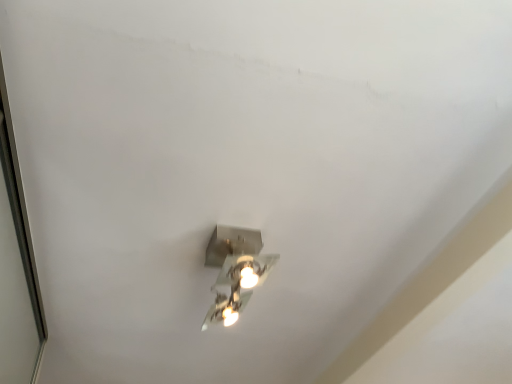
Question: From a real-world perspective, is transparent glass door at left on metallic silver light fixture at center?

Choices:
 (A) no
 (B) yes

Answer: (A)

Question: From the image's perspective, is transparent glass door at left below metallic silver light fixture at center?

Choices:
 (A) yes
 (B) no

Answer: (A)

Question: From the image's perspective, does transparent glass door at left appear higher than metallic silver light fixture at center?

Choices:
 (A) no
 (B) yes

Answer: (A)

Question: Does transparent glass door at left have a greater width compared to metallic silver light fixture at center?

Choices:
 (A) no
 (B) yes

Answer: (A)

Question: Can metallic silver light fixture at center be found inside transparent glass door at left?

Choices:
 (A) no
 (B) yes

Answer: (A)

Question: Is transparent glass door at left smaller than metallic silver light fixture at center?

Choices:
 (A) yes
 (B) no

Answer: (B)

Question: Is transparent glass door at left surrounded by metallic silver light fixture at center?

Choices:
 (A) no
 (B) yes

Answer: (A)

Question: Can you confirm if metallic silver light fixture at center is bigger than transparent glass door at left?

Choices:
 (A) yes
 (B) no

Answer: (B)

Question: From the image's perspective, is metallic silver light fixture at center under transparent glass door at left?

Choices:
 (A) yes
 (B) no

Answer: (B)

Question: Does metallic silver light fixture at center come in front of transparent glass door at left?

Choices:
 (A) yes
 (B) no

Answer: (B)

Question: From a real-world perspective, is metallic silver light fixture at center physically above transparent glass door at left?

Choices:
 (A) yes
 (B) no

Answer: (A)

Question: Would you say metallic silver light fixture at center is a long distance from transparent glass door at left?

Choices:
 (A) yes
 (B) no

Answer: (B)

Question: Is point (219, 291) closer or farther from the camera than point (6, 228)?

Choices:
 (A) farther
 (B) closer

Answer: (A)